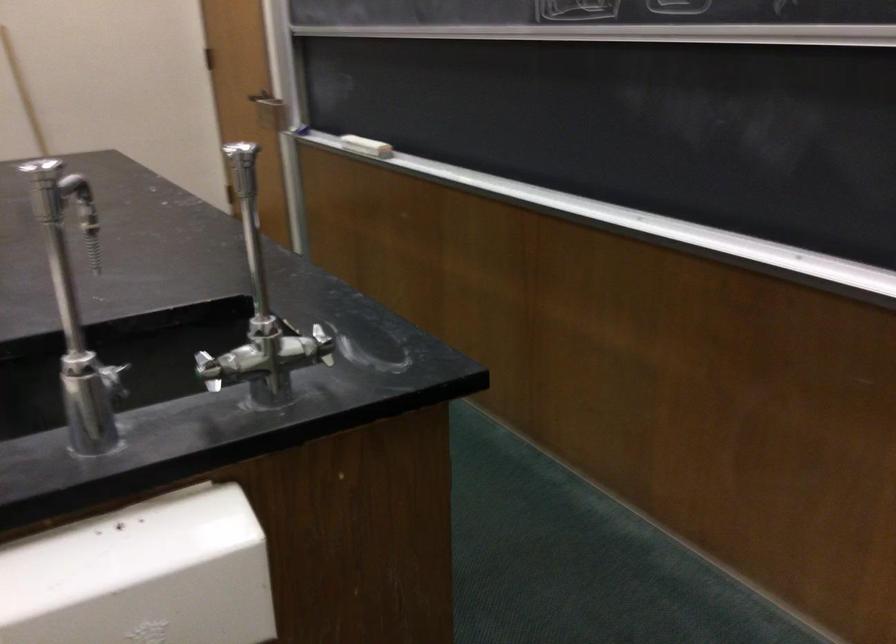
What do you see at coordinates (113, 379) in the screenshot? The height and width of the screenshot is (644, 896). I see `the faucet push button` at bounding box center [113, 379].